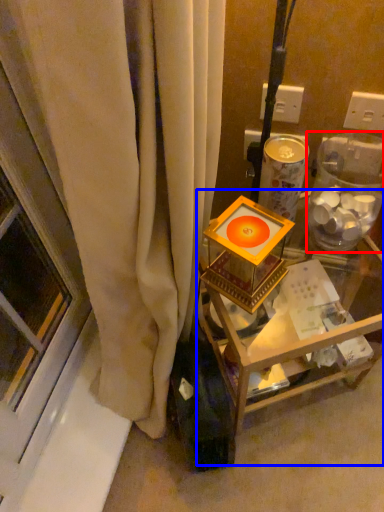
Question: Which of the following is the closest to the observer, glass box (highlighted by a red box) or furniture (highlighted by a blue box)?

Choices:
 (A) glass box
 (B) furniture

Answer: (A)